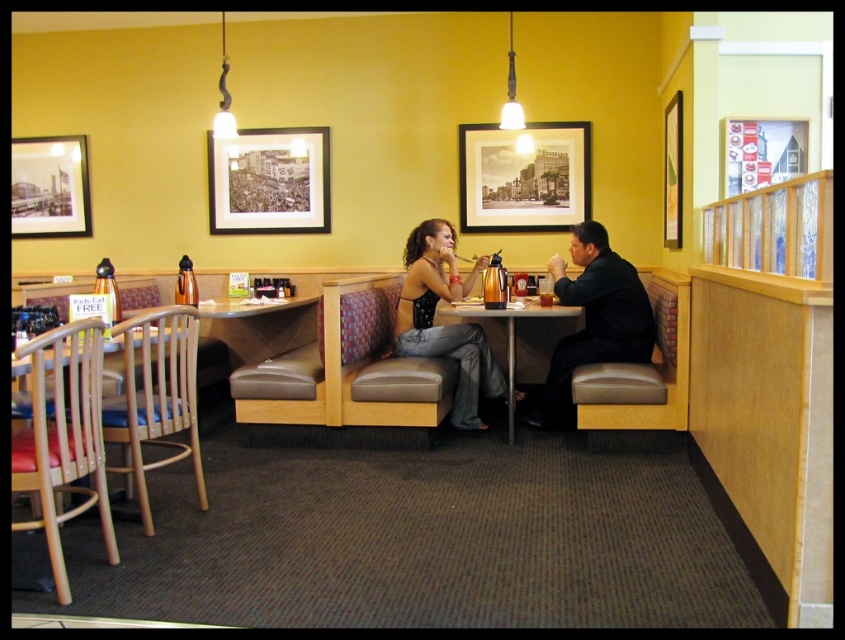
Is matte black dress at center thinner than wooden table at center?

Correct, matte black dress at center's width is less than wooden table at center's.

In the scene shown: Can you confirm if matte black dress at center is positioned above wooden table at center?

Indeed, matte black dress at center is positioned over wooden table at center.

Between point (598, 349) and point (510, 346), which one is positioned in front?

Point (598, 349) is more forward.

At what (x,y) coordinates should I click in order to perform the action: click on matte black dress at center. Please return your answer as a coordinate pair (x, y). The image size is (845, 640). Looking at the image, I should click on (593, 316).

From the picture: Who is taller, matte black tank top at center or wooden table at center?

With more height is matte black tank top at center.

Does matte black tank top at center appear on the left side of wooden table at center?

Indeed, matte black tank top at center is positioned on the left side of wooden table at center.

I want to click on matte black tank top at center, so click(x=444, y=324).

Which is in front, point (413, 317) or point (276, 189)?

Positioned in front is point (413, 317).

Where is `matte black dress at center`? matte black dress at center is located at coordinates (593, 316).